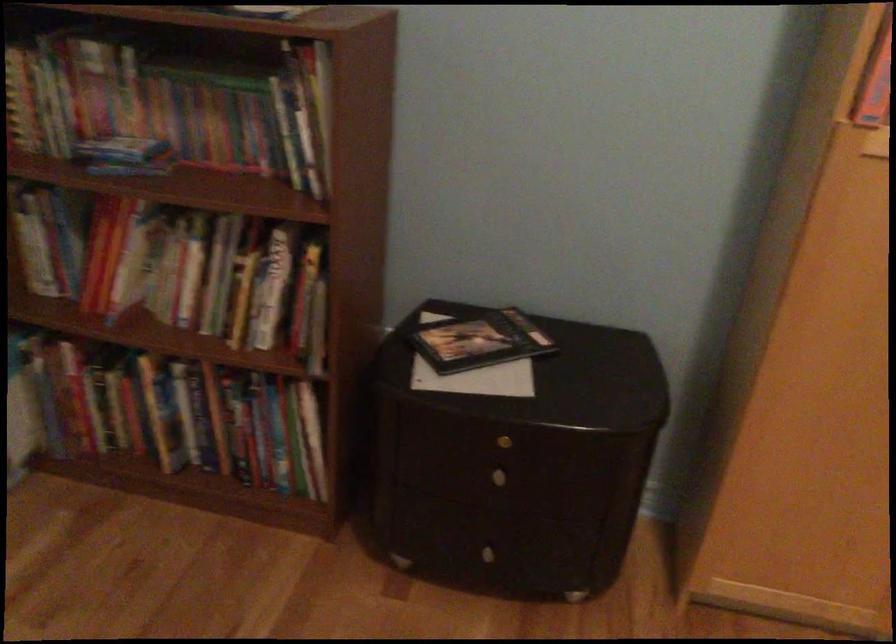
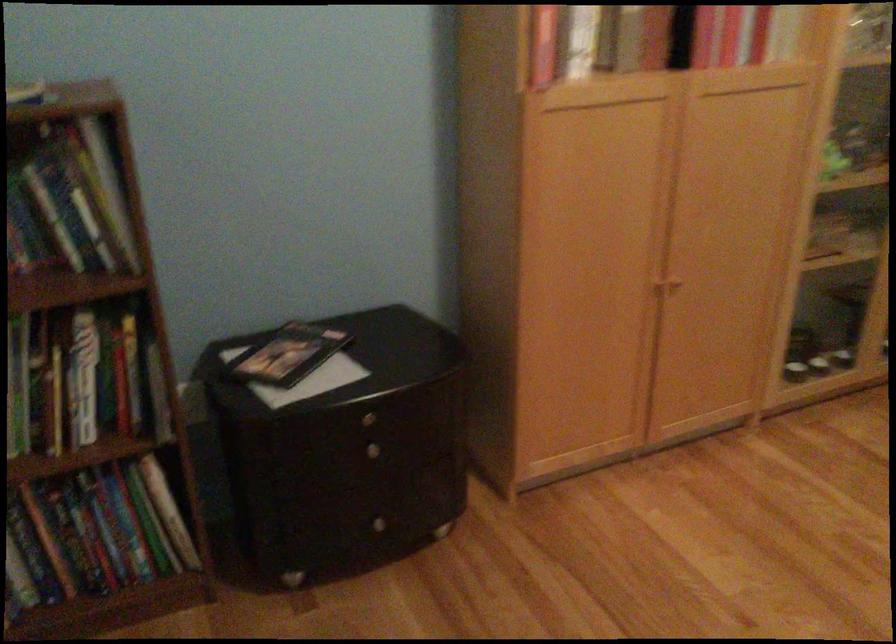
In the second image, find the point that corresponds to [505,436] in the first image.

(367, 415)